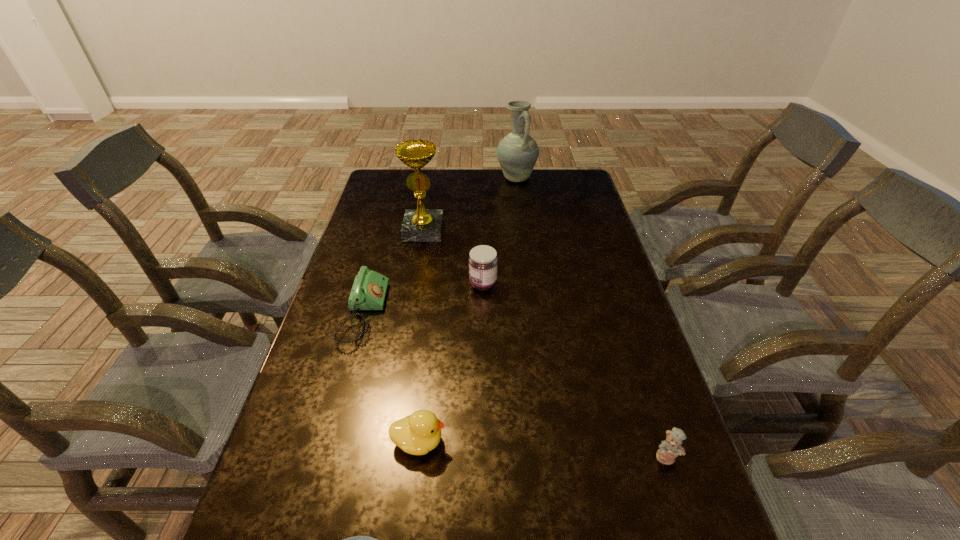
Identify the location of vacant region located on the front label of the third tallest object. This screenshot has width=960, height=540. (420, 284).

Find the location of a particular element. free region located on the front label of the third tallest object is located at coordinates (344, 284).

This screenshot has height=540, width=960. Find the location of `vacant space located 0.160m on the front label of the third tallest object`. vacant space located 0.160m on the front label of the third tallest object is located at coordinates (417, 284).

Where is `free space located 0.340m on the beak of the duckling`? This screenshot has width=960, height=540. free space located 0.340m on the beak of the duckling is located at coordinates (603, 441).

Locate an element on the screen. vacant space positioned 0.100m on the front-facing side of the teddy bear is located at coordinates (687, 518).

Where is `vacant space located 0.360m on the dial of the telephone`? This screenshot has height=540, width=960. vacant space located 0.360m on the dial of the telephone is located at coordinates (511, 313).

Where is `object that is at the far edge`? Image resolution: width=960 pixels, height=540 pixels. object that is at the far edge is located at coordinates (517, 153).

Locate an element on the screen. This screenshot has height=540, width=960. object situated at the left edge is located at coordinates click(369, 289).

Locate an element on the screen. object at the right edge is located at coordinates (669, 449).

What are the coordinates of `vacant space at the far edge of the desktop` in the screenshot? It's located at (475, 170).